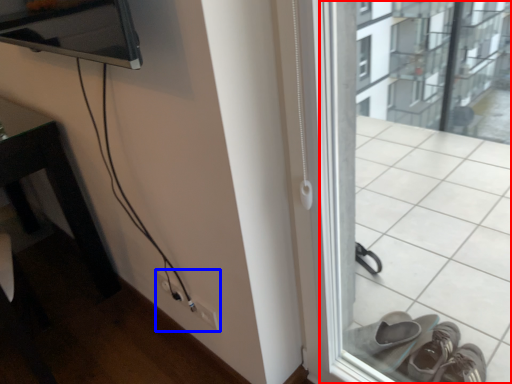
Question: Which object appears farthest to the camera in this image, window frame (highlighted by a red box) or electric outlet (highlighted by a blue box)?

Choices:
 (A) window frame
 (B) electric outlet

Answer: (B)